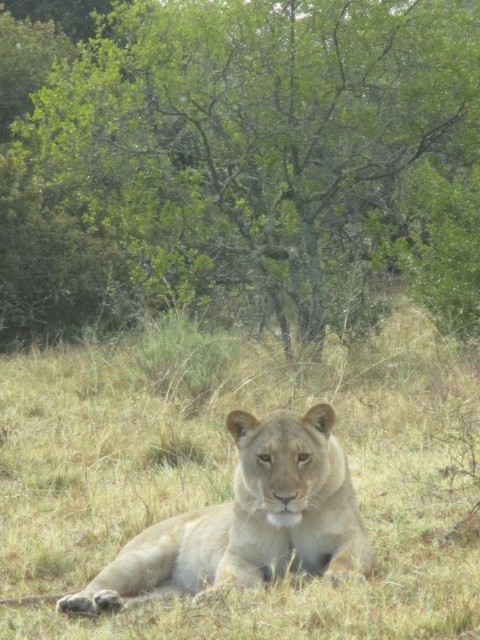
Question: Which object is the closest to the yellow dry grass at center?

Choices:
 (A) green leafy tree at center
 (B) light brown fur lion at center

Answer: (B)

Question: Does yellow dry grass at center appear on the left side of light brown fur lion at center?

Choices:
 (A) no
 (B) yes

Answer: (B)

Question: Can you confirm if green leafy tree at center is positioned above yellow dry grass at center?

Choices:
 (A) yes
 (B) no

Answer: (A)

Question: Which point is closer to the camera taking this photo?

Choices:
 (A) (140, 588)
 (B) (187, 262)
 (C) (206, 406)

Answer: (A)

Question: Is green leafy tree at center thinner than light brown fur lion at center?

Choices:
 (A) no
 (B) yes

Answer: (A)

Question: Among these objects, which one is farthest from the camera?

Choices:
 (A) light brown fur lion at center
 (B) green leafy tree at center

Answer: (B)